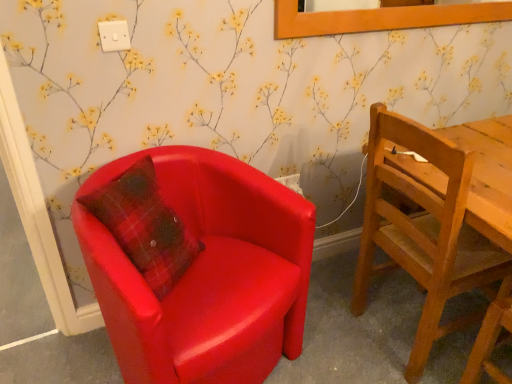
The width and height of the screenshot is (512, 384). What do you see at coordinates (114, 35) in the screenshot?
I see `white plastic power outlet at upper center, the first power outlet when ordered from top to bottom` at bounding box center [114, 35].

In order to face matte red armchair at left, acting as the 2th chair starting from the right, should I rotate leftwards or rightwards?

A 8.710 degree turn to the left will do.

What is the approximate width of white plastic power outlet at lower center, which is counted as the second power outlet, starting from the left?

The width of white plastic power outlet at lower center, which is counted as the second power outlet, starting from the left, is 0.84 inches.

This screenshot has width=512, height=384. Describe the element at coordinates (291, 182) in the screenshot. I see `white plastic power outlet at lower center, which ranks as the first power outlet in back-to-front order` at that location.

In order to face wooden picture frame at upper center, should I rotate leftwards or rightwards?

It's best to rotate right around 20.407 degrees.

The height and width of the screenshot is (384, 512). Identify the location of white plastic power outlet at upper center, acting as the 1th power outlet starting from the front. (114, 35).

Is matte red armchair at left, acting as the 2th chair starting from the right, bigger or smaller than white plastic power outlet at upper center, the 2th power outlet when ordered from back to front?

matte red armchair at left, acting as the 2th chair starting from the right, is bigger than white plastic power outlet at upper center, the 2th power outlet when ordered from back to front.

From the image's perspective, count 2nd power outlets upward from the matte red armchair at left, acting as the 2th chair starting from the right, and point to it. Please provide its 2D coordinates.

[(114, 35)]

Considering the positions of point (222, 194) and point (105, 22), is point (222, 194) closer or farther from the camera than point (105, 22)?

Point (222, 194) is farther from the camera than point (105, 22).

Is matte red armchair at left, acting as the 2th chair starting from the right, shorter than white plastic power outlet at upper center, which ranks as the 2th power outlet in bottom-to-top order?

Incorrect, the height of matte red armchair at left, acting as the 2th chair starting from the right, does not fall short of that of white plastic power outlet at upper center, which ranks as the 2th power outlet in bottom-to-top order.

Does point (106, 43) come behind point (287, 177)?

No.

Is white plastic power outlet at upper center, the 2th power outlet when ordered from back to front, bigger or smaller than white plastic power outlet at lower center, which is counted as the second power outlet, starting from the left?

white plastic power outlet at upper center, the 2th power outlet when ordered from back to front, is smaller than white plastic power outlet at lower center, which is counted as the second power outlet, starting from the left.

Is white plastic power outlet at upper center, the first power outlet viewed from the left, oriented towards white plastic power outlet at lower center, which ranks as the first power outlet in back-to-front order?

No, white plastic power outlet at upper center, the first power outlet viewed from the left, is not aimed at white plastic power outlet at lower center, which ranks as the first power outlet in back-to-front order.

Find the location of a particular element. power outlet above the white plastic power outlet at lower center, placed as the 1th power outlet when sorted from right to left (from a real-world perspective) is located at coordinates (114, 35).

From the image's perspective, would you say white plastic power outlet at upper center, acting as the 1th power outlet starting from the front, is shown under wooden chair at right, the 2th chair when ordered from left to right?

Incorrect, from the image's perspective, white plastic power outlet at upper center, acting as the 1th power outlet starting from the front, is higher than wooden chair at right, the 2th chair when ordered from left to right.

From a real-world perspective, does white plastic power outlet at upper center, acting as the 1th power outlet starting from the front, stand above wooden chair at right, the 2th chair when ordered from left to right?

Yes, from a real-world perspective, white plastic power outlet at upper center, acting as the 1th power outlet starting from the front, is on top of wooden chair at right, the 2th chair when ordered from left to right.

Does white plastic power outlet at upper center, the first power outlet viewed from the left, appear on the left side of wooden chair at right, the 2th chair when ordered from left to right?

Yes.

You are a GUI agent. You are given a task and a screenshot of the screen. Output one action in this format:
    pyautogui.click(x=<x>, y=<y>)
    Task: Click on the chair located on the left of white plastic power outlet at lower center, which is counted as the second power outlet, starting from the left
    This screenshot has height=384, width=512.
    Given the screenshot: What is the action you would take?
    [x=206, y=273]

In the image, is matte red armchair at left, acting as the 2th chair starting from the right, on the left side or the right side of white plastic power outlet at lower center, which is the 2th power outlet from top to bottom?

matte red armchair at left, acting as the 2th chair starting from the right, is positioned on white plastic power outlet at lower center, which is the 2th power outlet from top to bottom,'s left side.

From a real-world perspective, who is located lower, matte red armchair at left, arranged as the first chair when viewed from the left, or white plastic power outlet at lower center, placed as the 1th power outlet when sorted from right to left?

In real-world perspective, matte red armchair at left, arranged as the first chair when viewed from the left, is lower.

From the image's perspective, is white plastic power outlet at upper center, the 2th power outlet when ordered from back to front, beneath matte red armchair at left, acting as the 2th chair starting from the right?

No, from the image's perspective, white plastic power outlet at upper center, the 2th power outlet when ordered from back to front, is not beneath matte red armchair at left, acting as the 2th chair starting from the right.

Choose the correct answer: Is white plastic power outlet at upper center, the 2th power outlet when ordered from back to front, inside matte red armchair at left, acting as the 2th chair starting from the right, or outside it?

The correct answer is: outside.

From a real-world perspective, is white plastic power outlet at upper center, the first power outlet when ordered from top to bottom, above or below matte red armchair at left, arranged as the first chair when viewed from the left?

white plastic power outlet at upper center, the first power outlet when ordered from top to bottom, is situated higher than matte red armchair at left, arranged as the first chair when viewed from the left, in the real world.

Who is more distant, white plastic power outlet at upper center, the first power outlet when ordered from top to bottom, or matte red armchair at left, arranged as the first chair when viewed from the left?

Positioned behind is white plastic power outlet at upper center, the first power outlet when ordered from top to bottom.

Which of these two, wooden picture frame at upper center or white plastic power outlet at lower center, which ranks as the 2th power outlet in front-to-back order, is smaller?

white plastic power outlet at lower center, which ranks as the 2th power outlet in front-to-back order, is smaller.

This screenshot has height=384, width=512. What are the coordinates of `picture frame on the right of the white plastic power outlet at lower center, placed as the 1th power outlet when sorted from right to left` in the screenshot? It's located at (381, 18).

In the scene shown: Which object is further away from the camera taking this photo, wooden picture frame at upper center or white plastic power outlet at lower center, placed as the 1th power outlet when sorted from right to left?

Positioned behind is white plastic power outlet at lower center, placed as the 1th power outlet when sorted from right to left.

Which is correct: wooden picture frame at upper center is inside matte red armchair at left, arranged as the first chair when viewed from the left, or outside of it?

wooden picture frame at upper center exists outside the volume of matte red armchair at left, arranged as the first chair when viewed from the left.

Between wooden picture frame at upper center and matte red armchair at left, arranged as the first chair when viewed from the left, which one has less height?

wooden picture frame at upper center.

Is wooden picture frame at upper center thinner than matte red armchair at left, arranged as the first chair when viewed from the left?

Correct, the width of wooden picture frame at upper center is less than that of matte red armchair at left, arranged as the first chair when viewed from the left.

Considering the relative positions of wooden picture frame at upper center and matte red armchair at left, arranged as the first chair when viewed from the left, in the image provided, is wooden picture frame at upper center in front of matte red armchair at left, arranged as the first chair when viewed from the left,?

No, wooden picture frame at upper center is further to the viewer.

What are the coordinates of `the 1st chair counting from the right of the white plastic power outlet at upper center, the second power outlet from the right` in the screenshot? It's located at (206, 273).

There is a white plastic power outlet at lower center, which ranks as the first power outlet in back-to-front order. Where is `power outlet above it (from a real-world perspective)`? This screenshot has width=512, height=384. power outlet above it (from a real-world perspective) is located at coordinates (114, 35).

Consider the image. When comparing their distances from white plastic power outlet at upper center, the first power outlet viewed from the left, does matte red armchair at left, acting as the 2th chair starting from the right, or wooden picture frame at upper center seem further?

wooden picture frame at upper center.

Considering their positions, is matte red armchair at left, arranged as the first chair when viewed from the left, positioned further to white plastic power outlet at lower center, placed as the 1th power outlet when sorted from right to left, than wooden picture frame at upper center?

wooden picture frame at upper center.

From the image, which object appears to be nearer to white plastic power outlet at lower center, which ranks as the first power outlet in back-to-front order, wooden picture frame at upper center or white plastic power outlet at upper center, the first power outlet viewed from the left?

The object closer to white plastic power outlet at lower center, which ranks as the first power outlet in back-to-front order, is wooden picture frame at upper center.

Based on their spatial positions, is wooden picture frame at upper center or white plastic power outlet at lower center, which ranks as the 2th power outlet in front-to-back order, closer to white plastic power outlet at upper center, the first power outlet when ordered from top to bottom?

white plastic power outlet at lower center, which ranks as the 2th power outlet in front-to-back order, lies closer to white plastic power outlet at upper center, the first power outlet when ordered from top to bottom, than the other object.

Looking at the image, which one is located further to wooden picture frame at upper center, wooden chair at right, the 2th chair when ordered from left to right, or white plastic power outlet at upper center, which ranks as the 2th power outlet in bottom-to-top order?

white plastic power outlet at upper center, which ranks as the 2th power outlet in bottom-to-top order, lies further to wooden picture frame at upper center than the other object.

Considering their positions, is white plastic power outlet at lower center, which ranks as the 2th power outlet in front-to-back order, positioned further to white plastic power outlet at upper center, the first power outlet when ordered from top to bottom, than matte red armchair at left, acting as the 2th chair starting from the right?

white plastic power outlet at lower center, which ranks as the 2th power outlet in front-to-back order, is further to white plastic power outlet at upper center, the first power outlet when ordered from top to bottom.

From the image, which object appears to be nearer to wooden picture frame at upper center, white plastic power outlet at lower center, which ranks as the first power outlet in back-to-front order, or matte red armchair at left, acting as the 2th chair starting from the right?

white plastic power outlet at lower center, which ranks as the first power outlet in back-to-front order, is closer to wooden picture frame at upper center.

Based on their spatial positions, is white plastic power outlet at upper center, the second power outlet from the right, or wooden picture frame at upper center further from wooden chair at right, the 2th chair when ordered from left to right?

white plastic power outlet at upper center, the second power outlet from the right, is further to wooden chair at right, the 2th chair when ordered from left to right.

At what (x,y) coordinates should I click in order to perform the action: click on power outlet between white plastic power outlet at upper center, the second power outlet from the right, and wooden chair at right, positioned as the 1th chair in right-to-left order, in the horizontal direction. Please return your answer as a coordinate pair (x, y). Looking at the image, I should click on coord(291,182).

Image resolution: width=512 pixels, height=384 pixels. What are the coordinates of `chair positioned between matte red armchair at left, arranged as the first chair when viewed from the left, and white plastic power outlet at lower center, placed as the 1th power outlet when sorted from right to left, from near to far` in the screenshot? It's located at (424, 227).

At what (x,y) coordinates should I click in order to perform the action: click on power outlet between white plastic power outlet at upper center, the first power outlet viewed from the left, and wooden picture frame at upper center, in the horizontal direction. Please return your answer as a coordinate pair (x, y). The width and height of the screenshot is (512, 384). Looking at the image, I should click on (291, 182).

Where is `power outlet between matte red armchair at left, arranged as the first chair when viewed from the left, and white plastic power outlet at lower center, which is counted as the second power outlet, starting from the left, from front to back`? The width and height of the screenshot is (512, 384). power outlet between matte red armchair at left, arranged as the first chair when viewed from the left, and white plastic power outlet at lower center, which is counted as the second power outlet, starting from the left, from front to back is located at coordinates click(x=114, y=35).